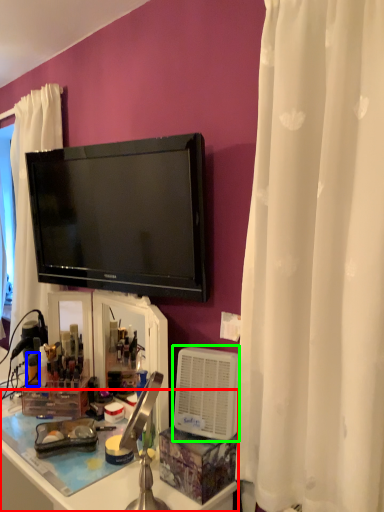
Question: Which object is the closest to the desk (highlighted by a red box)? Choose among these: toiletry (highlighted by a blue box) or appliance (highlighted by a green box).

Choices:
 (A) toiletry
 (B) appliance

Answer: (B)